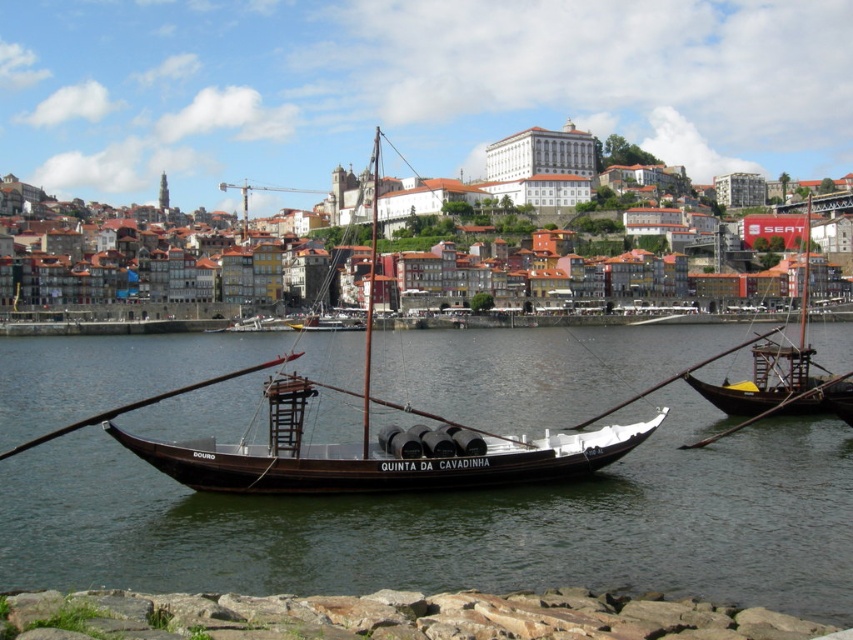
You are standing on the riverside path and see the brown wooden water at center and the wooden sailboat at center. Which object is closer to the water surface?

The brown wooden water at center is below the wooden sailboat at center, so the brown wooden water at center is closer to the water surface.

You are a tourist standing at the riverbank in Porto, Portugal. You see the wooden sailboat at center. Can you determine its exact location in terms of coordinates?

The wooden sailboat at center is located at coordinates point [379,444].

You are a tourist standing on the riverbank and want to take a photo of both the wooden sailboat at center and the wooden sailboat at right. Based on their positions, which boat should you focus on first if you want to include both in your photo without moving your camera?

The wooden sailboat at center is above the wooden sailboat at right, so you should focus on the wooden sailboat at center first to ensure both are in frame without moving the camera.